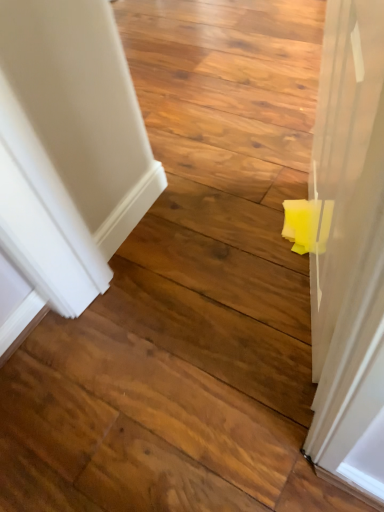
Identify the location of free space to the left of yellow sponge at right. (207, 285).